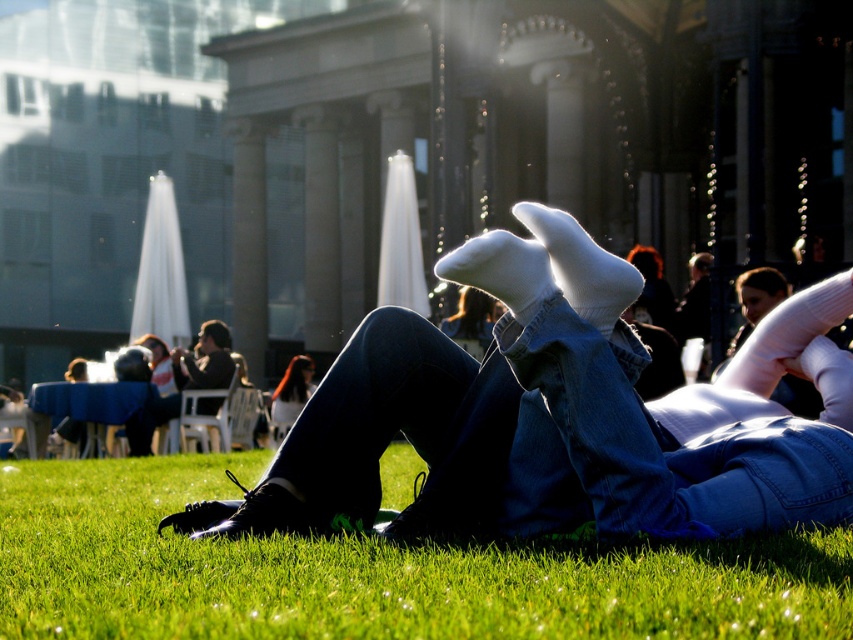
You are standing at the center of the park and see the dark brown leather jacket at upper left. Based on its position, can you estimate whether it is closer to the building with classical architecture or to the white umbrellas on the left side?

The dark brown leather jacket at upper left is located at point (206, 360). Since the building is to the left of the umbrellas, the jacket is closer to the building.

You are a photographer trying to capture a shot of the green grass at lower center and the blonde hair at center. Which object is shorter in height?

The green grass at lower center is shorter in height compared to the blonde hair at center.

You are a photographer trying to capture a shot of the dark brown leather jacket at upper left and the blonde hair at center. Which object should you zoom in on to ensure it fills the frame more, considering their sizes?

The dark brown leather jacket at upper left is wider than the blonde hair at center, so you should zoom in on the dark brown leather jacket at upper left to fill the frame more.